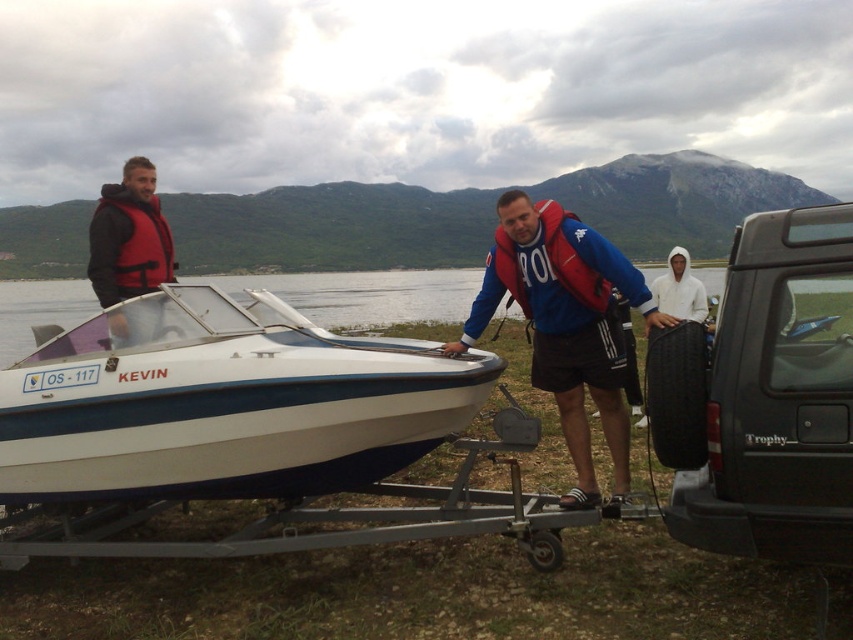
You are a safety inspector checking the placement of safety gear on the lakeside scene. The red fabric life vest at center and the white hoodie at center are both visible. According to safety regulations, life vests must be placed to the right of any clothing items. Is the current placement compliant?

The red fabric life vest at center is to the left of the white hoodie at center, which violates the safety regulation requiring life vests to be placed to the right of clothing items. The current placement is not compliant.

Based on the scene description, where is the black rubber tire at lower right located in terms of coordinates?

The black rubber tire at lower right is located at coordinates (764, 396).